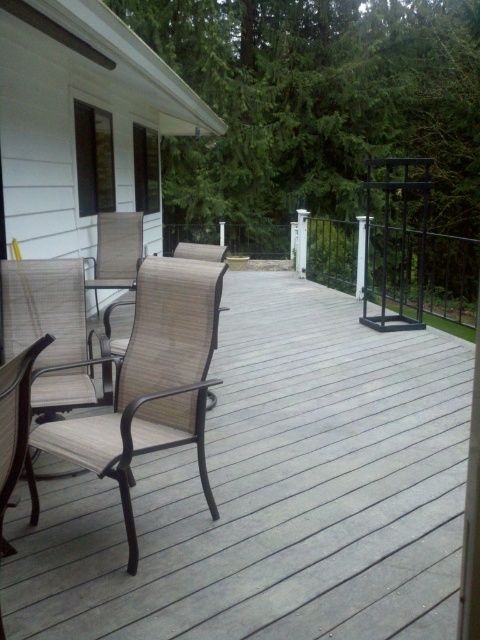
You are sitting on the beige fabric chair at center and want to get up to walk to the deck railing on the far right. Can you easily stand up without moving the brown woven chairs at center?

The beige fabric chair at center is behind the brown woven chairs at center, so you would need to move the brown woven chairs at center first to stand up and walk to the deck railing on the far right.

You are sitting on the sanded wood chair at left and want to move to the beige fabric chair at center. Which direction should you move to reach it?

The beige fabric chair at center is to the right of the sanded wood chair at left, so you should move to the right to reach it.

You are standing on the wooden deck and want to sit down on either the beige fabric chair at center or the sanded wood chair at left. Which chair will you reach first if you walk straight ahead?

The beige fabric chair at center will be reached first because it is closer to you than the sanded wood chair at left, which is positioned further away.